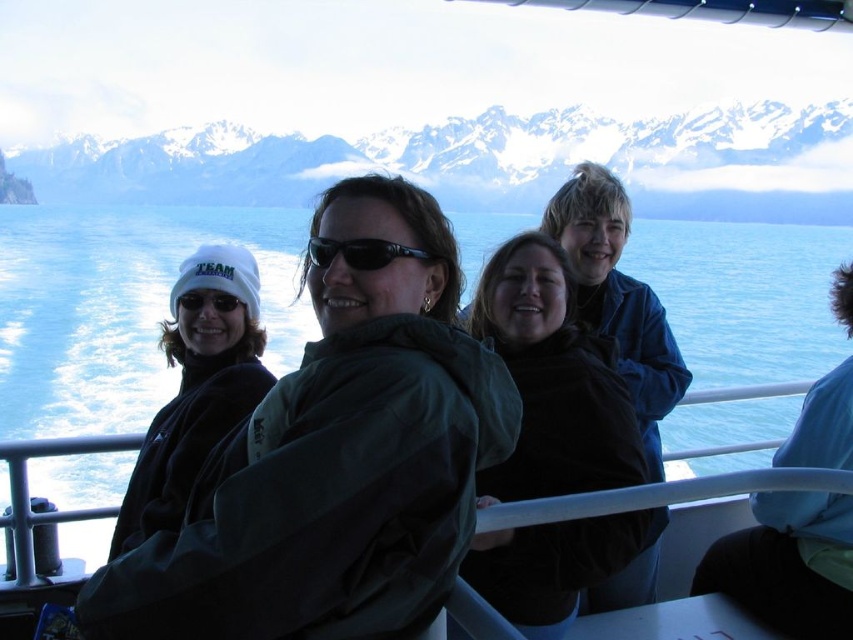
Question: Where is snowy mountain range at upper center located in relation to black plastic sunglasses at center in the image?

Choices:
 (A) right
 (B) left

Answer: (B)

Question: Can you confirm if green matte jacket at center is positioned to the left of dark brown jacket at center?

Choices:
 (A) yes
 (B) no

Answer: (A)

Question: Which object is positioned closest to the white fleece beanie at left?

Choices:
 (A) green matte jacket at center
 (B) snowy mountain range at upper center
 (C) black plastic sunglasses at center

Answer: (A)

Question: Considering the real-world distances, which object is closest to the white fleece beanie at left?

Choices:
 (A) black plastic sunglasses at center
 (B) dark brown jacket at center

Answer: (A)

Question: Which object is positioned closest to the dark brown jacket at center?

Choices:
 (A) snowy mountain range at upper center
 (B) matte black goggles at center
 (C) white fleece beanie at left

Answer: (C)

Question: Is green matte jacket at center bigger than white fleece beanie at left?

Choices:
 (A) yes
 (B) no

Answer: (A)